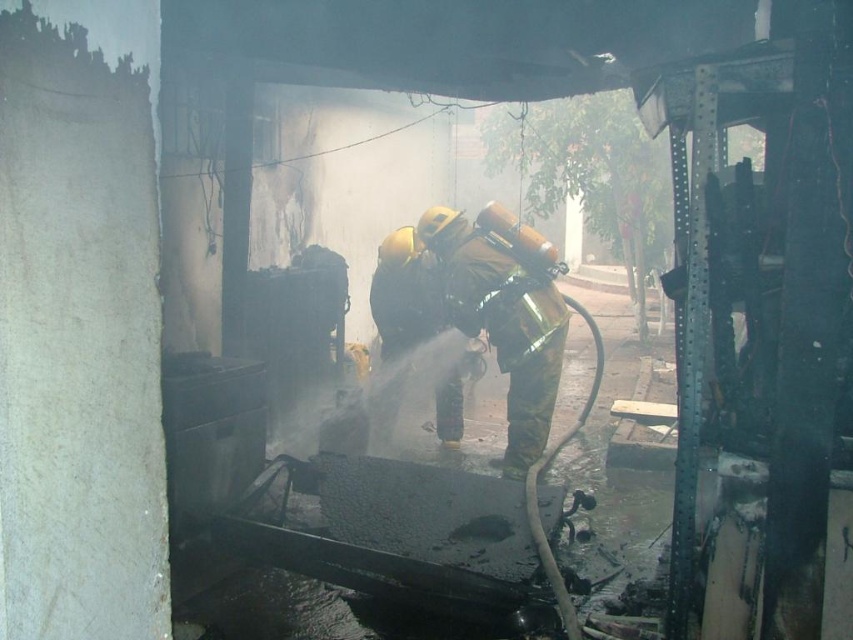
Is camouflage fabric fireman at center thinner than shiny gold helmet at center?

In fact, camouflage fabric fireman at center might be wider than shiny gold helmet at center.

Can you confirm if camouflage fabric fireman at center is wider than shiny gold helmet at center?

Correct, the width of camouflage fabric fireman at center exceeds that of shiny gold helmet at center.

Between point (529, 266) and point (428, 324), which one is positioned in front?

Point (529, 266) is in front.

This screenshot has width=853, height=640. Find the location of `camouflage fabric fireman at center`. camouflage fabric fireman at center is located at coordinates (505, 312).